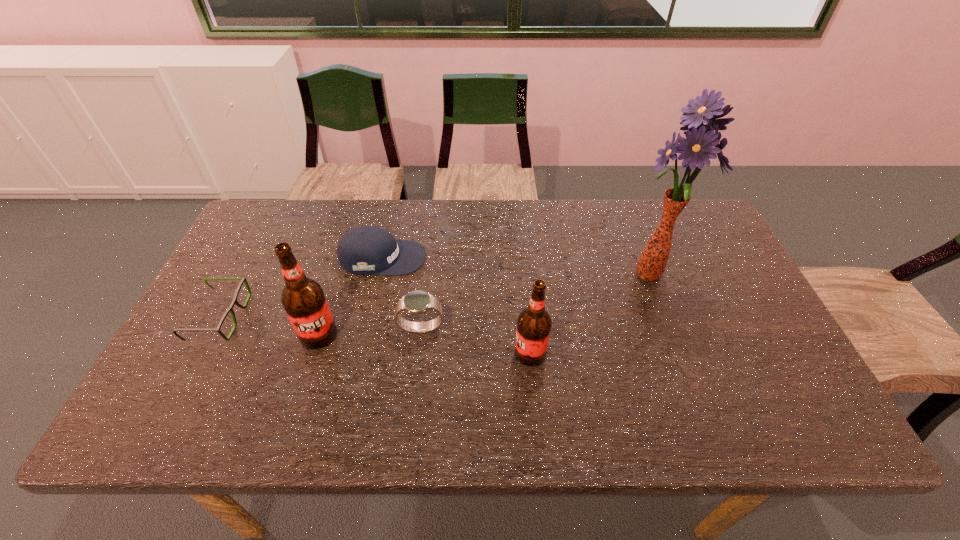
You are a GUI agent. You are given a task and a screenshot of the screen. Output one action in this format:
    pyautogui.click(x=<x>, y=<y>)
    Task: Click on the free point that satisfies the following two spatial constraints: 1. on the front-facing side of the baseball cap; 2. on the left side of the flower arrangement
    The image size is (960, 540).
    Given the screenshot: What is the action you would take?
    pyautogui.click(x=378, y=275)